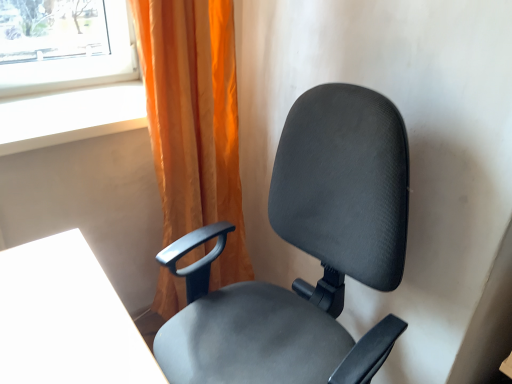
This screenshot has width=512, height=384. What do you see at coordinates (194, 120) in the screenshot? I see `orange fabric curtain at left` at bounding box center [194, 120].

Where is `orange fabric curtain at left`? orange fabric curtain at left is located at coordinates (194, 120).

What is the approximate height of orange fabric curtain at left?

1.11 meters.

Locate an element on the screen. This screenshot has height=384, width=512. orange fabric curtain at left is located at coordinates (194, 120).